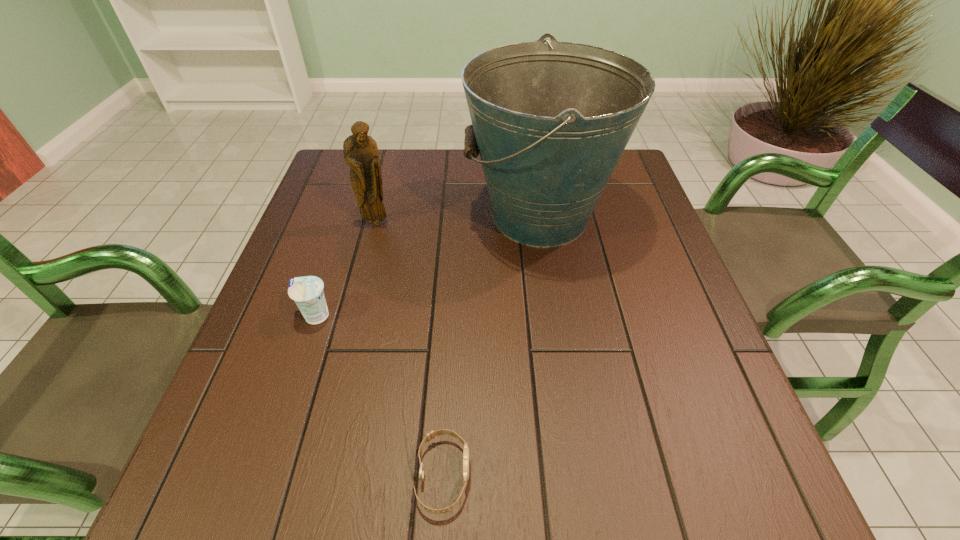
Locate an element on the screen. This screenshot has height=540, width=960. bucket is located at coordinates (550, 121).

The height and width of the screenshot is (540, 960). I want to click on figurine, so click(x=361, y=153).

This screenshot has height=540, width=960. I want to click on yogurt, so click(307, 292).

Image resolution: width=960 pixels, height=540 pixels. Find the location of `the third farthest object`. the third farthest object is located at coordinates coord(307,292).

Identify the location of watch. (432, 434).

I want to click on the shortest object, so click(x=432, y=434).

You are a GUI agent. You are given a task and a screenshot of the screen. Output one action in this format:
    pyautogui.click(x=<x>, y=<y>)
    Task: Click on the vacant area situated 0.400m with the handle on opposite sides of the tallest object
    The image size is (960, 540).
    Given the screenshot: What is the action you would take?
    pyautogui.click(x=311, y=217)

The height and width of the screenshot is (540, 960). In order to click on blank space located with the handle on opposite sides of the tallest object in this screenshot , I will do `click(353, 217)`.

Locate an element on the screen. vacant position located with the handle on opposite sides of the tallest object is located at coordinates (446, 217).

What are the coordinates of `free space located on the front-facing side of the second tallest object` in the screenshot? It's located at (367, 261).